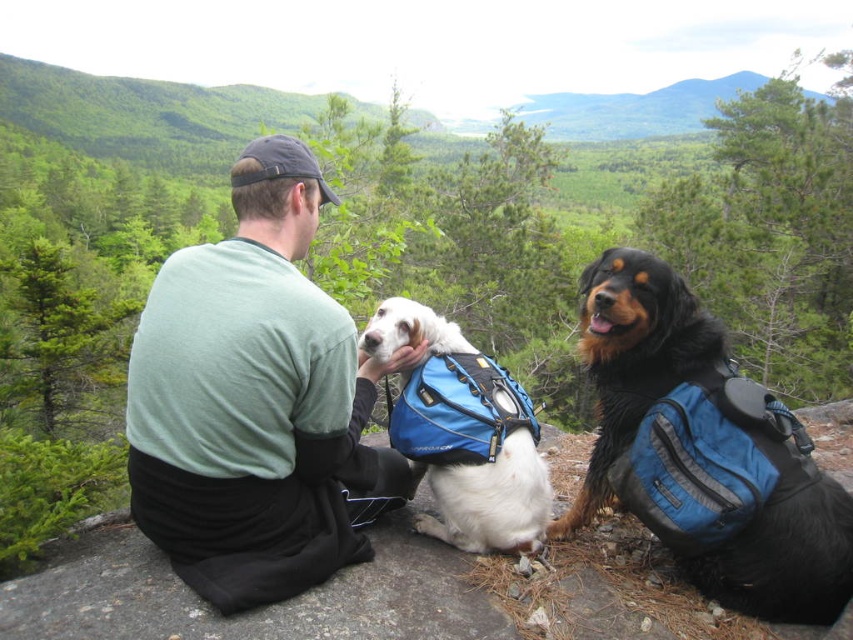
You are a hiker who wants to take a photo of the black fuzzy dog at center and the white soft fur dog at center. Which dog should you aim your camera to the right of to capture both in the frame?

You should aim your camera to the right of the white soft fur dog at center because the black fuzzy dog at center is positioned to the right of it.

You are a photographer trying to capture a photo of the white soft fur dog at center and the green cotton shirt at center. From your current position, which object is positioned to the left?

The green cotton shirt at center is to the left of the white soft fur dog at center, so the green cotton shirt at center is positioned to the left.